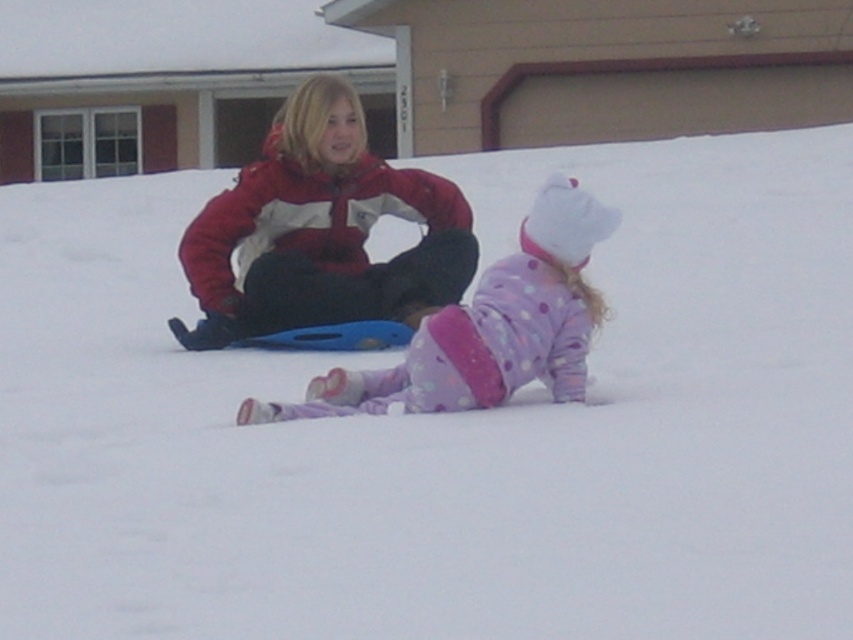
Which is above, red jacket at center or polka dot fleece pants at center?

Positioned higher is red jacket at center.

Can you confirm if red jacket at center is positioned below polka dot fleece pants at center?

Actually, red jacket at center is above polka dot fleece pants at center.

In order to click on red jacket at center in this screenshot , I will do `click(320, 230)`.

Identify the location of red jacket at center. This screenshot has height=640, width=853. (320, 230).